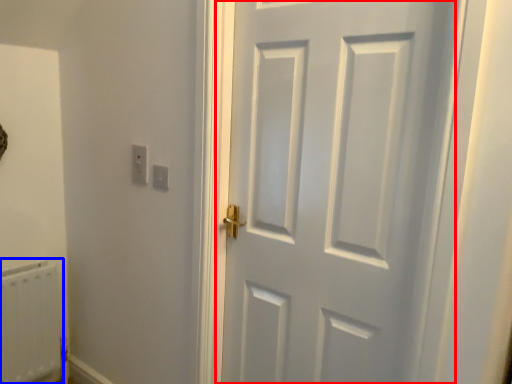
Question: Which object appears closest to the camera in this image, door (highlighted by a red box) or radiator (highlighted by a blue box)?

Choices:
 (A) door
 (B) radiator

Answer: (A)